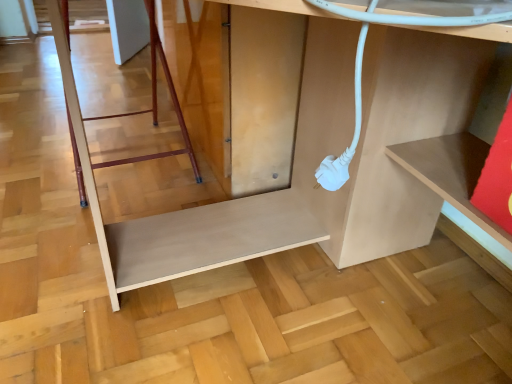
The image size is (512, 384). Identify the location of free region under matte white cable at lower center (from a real-world perspective). (332, 311).